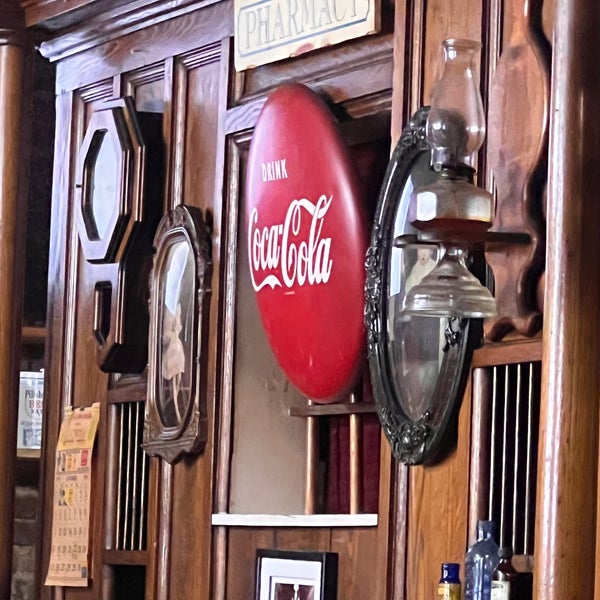
The width and height of the screenshot is (600, 600). What are the coordinates of `lamp holder` in the screenshot? It's located at (514, 199).